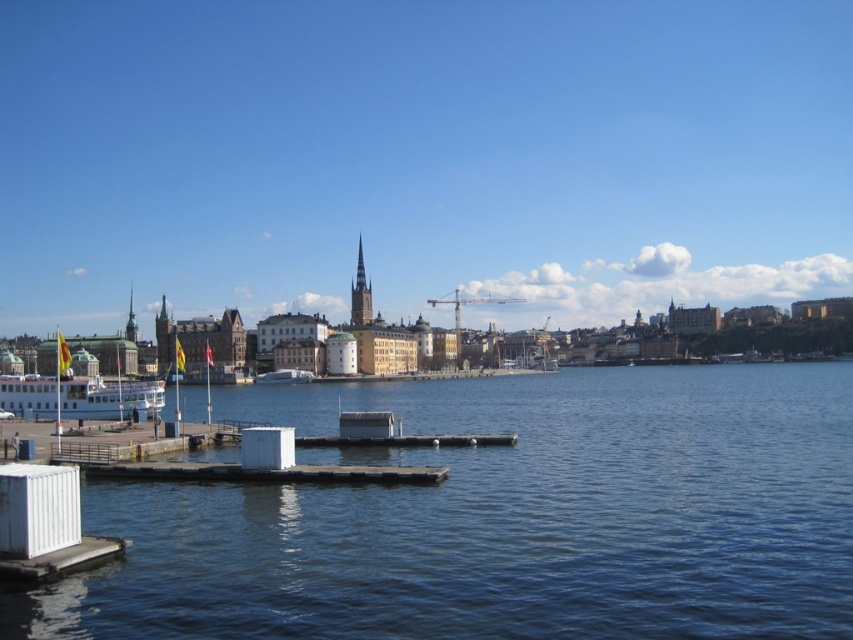
Question: Considering the real-world distances, which object is closest to the gold textured spire at center-left?

Choices:
 (A) transparent water at lower left
 (B) white glossy ferry at left

Answer: (B)

Question: Is white glossy ferry at left behind gold textured spire at center-left?

Choices:
 (A) yes
 (B) no

Answer: (B)

Question: Does white glossy ferry at left have a smaller size compared to gold textured spire at center-left?

Choices:
 (A) no
 (B) yes

Answer: (B)

Question: Among these points, which one is farthest from the camera?

Choices:
 (A) (47, 401)
 (B) (132, 337)

Answer: (B)

Question: Does transparent water at lower left come in front of white glossy ferry at left?

Choices:
 (A) no
 (B) yes

Answer: (B)

Question: Which is nearer to the transparent water at lower left?

Choices:
 (A) smooth stone spire at center
 (B) gold textured spire at center-left
 (C) white glossy ferry at left

Answer: (C)